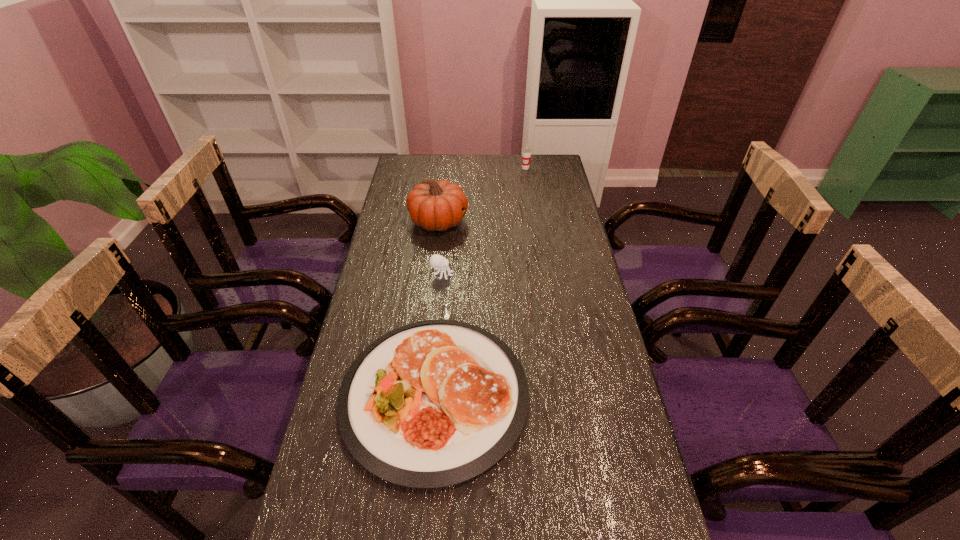
This screenshot has width=960, height=540. Find the location of `vacant area situated 0.190m on the front-facing side of the second shortest object`. vacant area situated 0.190m on the front-facing side of the second shortest object is located at coordinates (511, 274).

The image size is (960, 540). I want to click on vacant space positioned on the back of the dish, so click(x=446, y=254).

What are the coordinates of `object located in the far edge section of the desktop` in the screenshot? It's located at (526, 151).

Find the location of a particular element. pumpkin that is positioned at the left edge is located at coordinates (433, 205).

In order to click on dish that is at the left edge in this screenshot , I will do `click(433, 403)`.

You are a GUI agent. You are given a task and a screenshot of the screen. Output one action in this format:
    pyautogui.click(x=<x>, y=<y>)
    Task: Click on the object located at the right edge
    This screenshot has height=540, width=960.
    Given the screenshot: What is the action you would take?
    (x=526, y=151)

Identify the location of object that is at the far right corner. (526, 151).

Locate an element on the screen. vacant space at the far edge of the desktop is located at coordinates (510, 158).

Where is `blank space at the left edge of the desktop`? blank space at the left edge of the desktop is located at coordinates (348, 349).

I want to click on vacant space at the right edge of the desktop, so click(x=566, y=379).